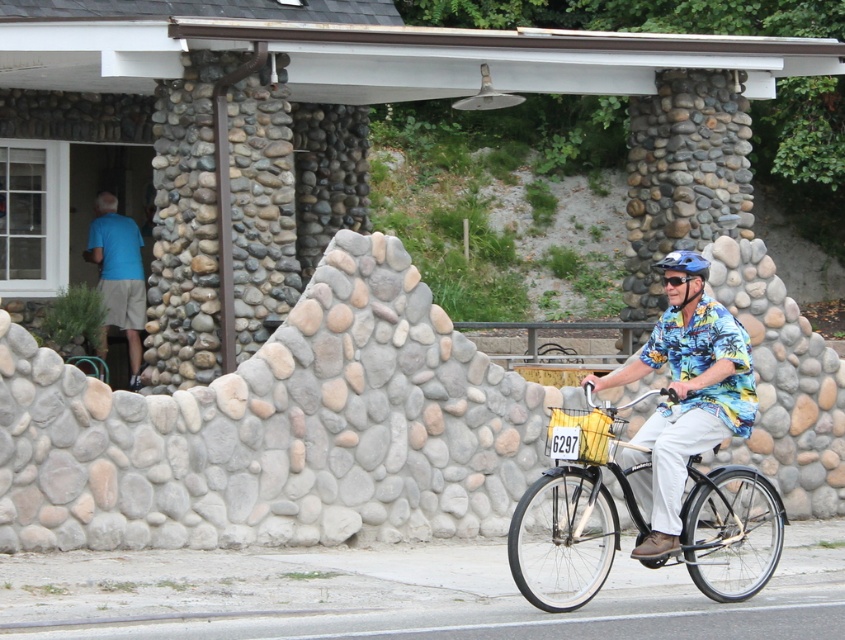
You are standing in the street and see the blue cotton shirt at left and the yellow fabric basket at center. Which object is closer to you?

The blue cotton shirt at left is closer to you because it is further to the viewer than the yellow fabric basket at center.

You are a photographer standing in the scene. You want to take a photo of the yellow fabric basket at center without the blue cotton shirt at left appearing in the frame. Is this possible given their positions?

The blue cotton shirt at left is to the left of the yellow fabric basket at center, so if you position yourself to the right side of the basket, you can frame the shot so that the shirt is out of view.

You are a photographer standing in the street and want to take a photo of the cyclist. You notice the blue cotton shirt at left and the blue matte helmet at center. Which object should you focus on first if you want to capture both in the same frame without moving the camera?

You should focus on the blue matte helmet at center first because the blue cotton shirt at left is located below it, so adjusting focus to the helmet will ensure both are in the frame.